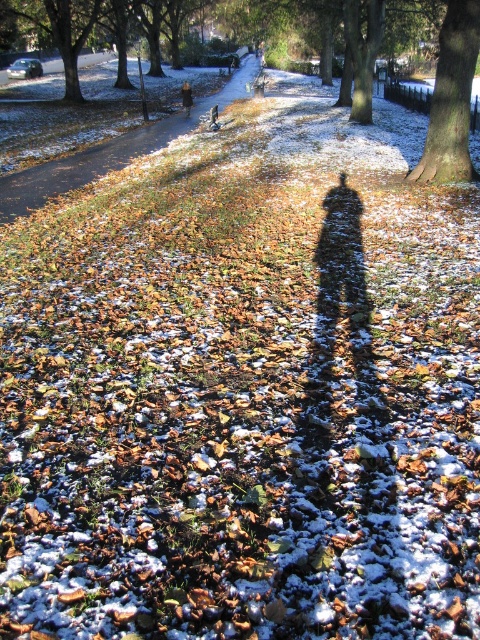
Question: Is brown leafy path at center wider than brown rough textured tree at center right?

Choices:
 (A) yes
 (B) no

Answer: (A)

Question: From the image, what is the correct spatial relationship of brown leafy path at center in relation to brown rough textured tree at center right?

Choices:
 (A) left
 (B) right

Answer: (A)

Question: Which point is farther from the camera taking this photo?

Choices:
 (A) (456, 140)
 (B) (115, 168)

Answer: (B)

Question: Can you confirm if brown leafy path at center is positioned above brown rough textured tree at center right?

Choices:
 (A) yes
 (B) no

Answer: (A)